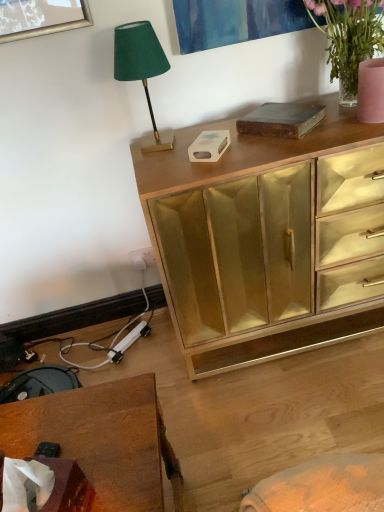
Locate an element on the screen. This screenshot has height=512, width=384. spots to the right of green velvet lampshade at upper left is located at coordinates (x=196, y=134).